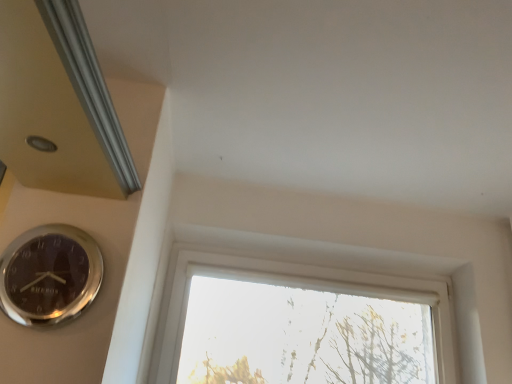
Question: Is transparent glass window at center spatially inside silver metallic wall clock at lower left, or outside of it?

Choices:
 (A) inside
 (B) outside

Answer: (B)

Question: From a real-world perspective, is transparent glass window at center above or below silver metallic wall clock at lower left?

Choices:
 (A) below
 (B) above

Answer: (B)

Question: Visually, is transparent glass window at center positioned to the left or to the right of silver metallic wall clock at lower left?

Choices:
 (A) right
 (B) left

Answer: (A)

Question: From the image's perspective, relative to transparent glass window at center, is silver metallic wall clock at lower left above or below?

Choices:
 (A) below
 (B) above

Answer: (B)

Question: Considering the relative positions of silver metallic wall clock at lower left and transparent glass window at center in the image provided, is silver metallic wall clock at lower left to the left or to the right of transparent glass window at center?

Choices:
 (A) left
 (B) right

Answer: (A)

Question: From a real-world perspective, is silver metallic wall clock at lower left physically located above or below transparent glass window at center?

Choices:
 (A) above
 (B) below

Answer: (B)

Question: Considering the positions of silver metallic wall clock at lower left and transparent glass window at center in the image, is silver metallic wall clock at lower left wider or thinner than transparent glass window at center?

Choices:
 (A) wide
 (B) thin

Answer: (B)